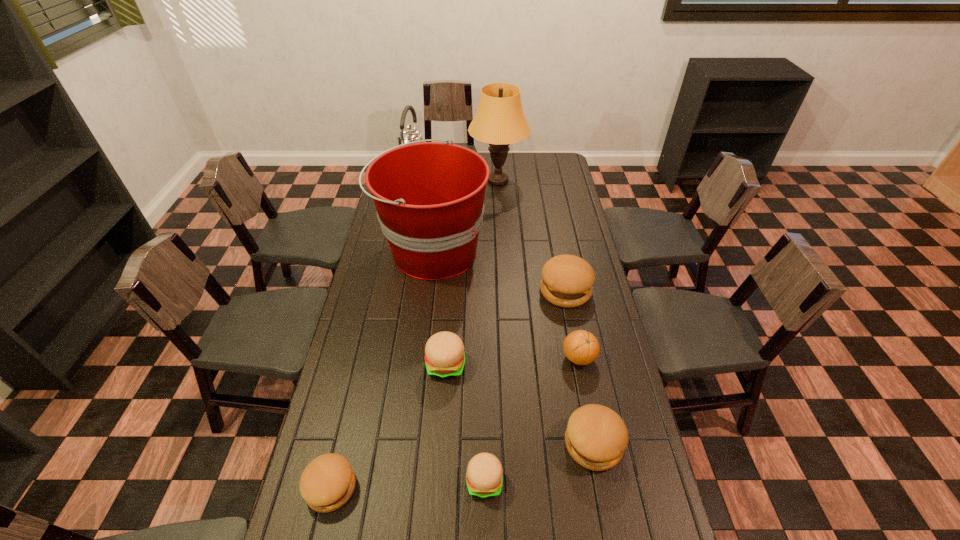
You are a GUI agent. You are given a task and a screenshot of the screen. Output one action in this format:
    pyautogui.click(x=<x>, y=<y>)
    Task: Click on the vacant space situated on the right of the smallest brown hamburger
    Image resolution: width=960 pixels, height=540 pixels.
    Given the screenshot: What is the action you would take?
    pyautogui.click(x=418, y=488)

You are a GUI agent. You are given a task and a screenshot of the screen. Output one action in this format:
    pyautogui.click(x=<x>, y=<y>)
    Task: Click on the free space located on the left of the smaller beige hamburger
    
    Given the screenshot: What is the action you would take?
    pyautogui.click(x=440, y=481)

Locate an element on the screen. The image size is (960, 540). lampshade situated at the far edge is located at coordinates (499, 121).

Where is `kettle at the far edge`? kettle at the far edge is located at coordinates (409, 134).

The height and width of the screenshot is (540, 960). In order to click on bucket located at the left edge in this screenshot , I will do `click(429, 196)`.

Identify the location of kettle situated at the left edge. (409, 134).

Identify the location of hamburger present at the left edge. The height and width of the screenshot is (540, 960). (328, 481).

Find the location of a particular element. The image size is (960, 540). orange that is at the right edge is located at coordinates (581, 347).

Find the location of a particular element. The image size is (960, 540). object present at the far left corner is located at coordinates (409, 134).

This screenshot has height=540, width=960. I want to click on vacant region at the far edge of the desktop, so 532,165.